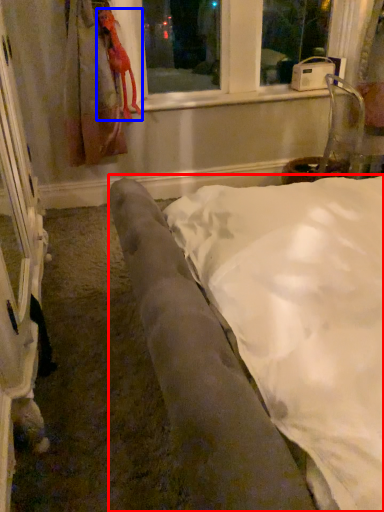
Question: Among these objects, which one is nearest to the camera, furniture (highlighted by a red box) or animal (highlighted by a blue box)?

Choices:
 (A) furniture
 (B) animal

Answer: (A)